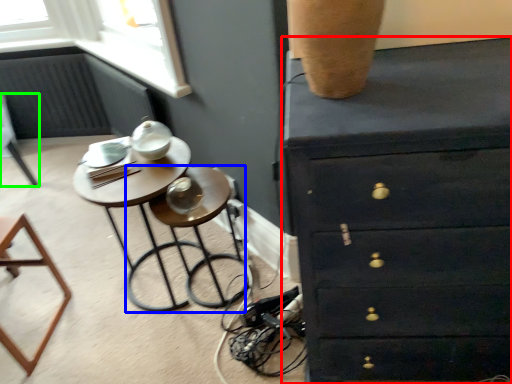
Question: Based on their relative distances, which object is farther from chest of drawers (highlighted by a red box)? Choose from bar stool (highlighted by a blue box) and furniture (highlighted by a green box).

Choices:
 (A) bar stool
 (B) furniture

Answer: (B)